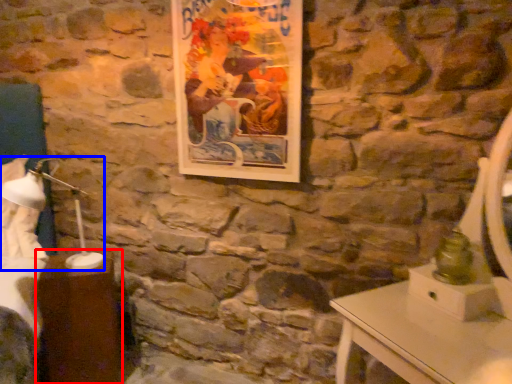
Question: Which of the following is the farthest to the observer, table (highlighted by a red box) or bedside lamp (highlighted by a blue box)?

Choices:
 (A) table
 (B) bedside lamp

Answer: (A)